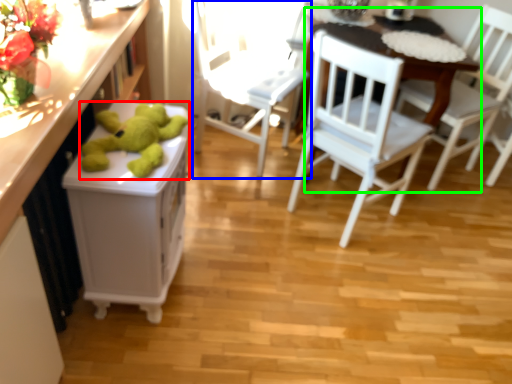
Question: Based on their relative distances, which object is farther from toy (highlighted by a red box)? Choose from chair (highlighted by a blue box) and table (highlighted by a green box).

Choices:
 (A) chair
 (B) table

Answer: (B)